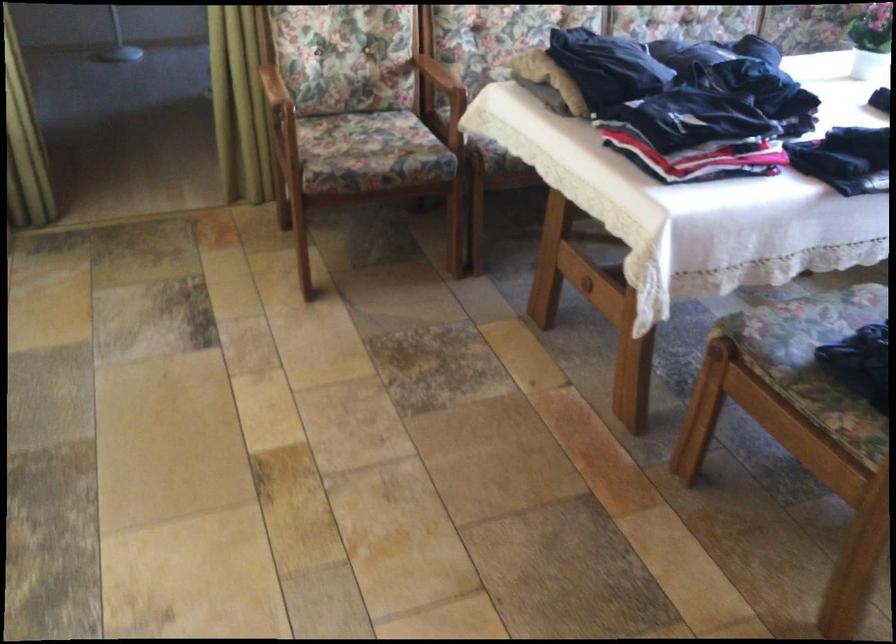
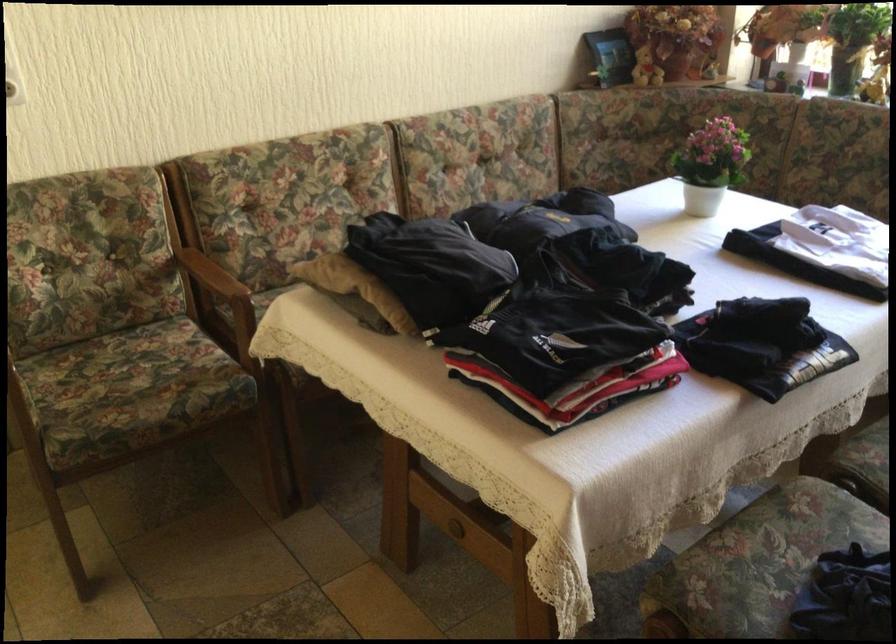
In the second image, find the point that corresponds to pixel 360 146 in the first image.

(130, 383)